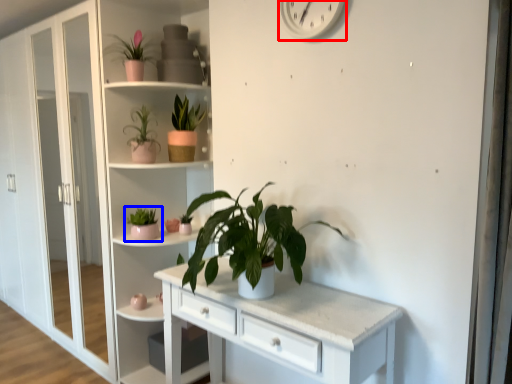
Question: Which object appears farthest to the camera in this image, clock (highlighted by a red box) or houseplant (highlighted by a blue box)?

Choices:
 (A) clock
 (B) houseplant

Answer: (B)